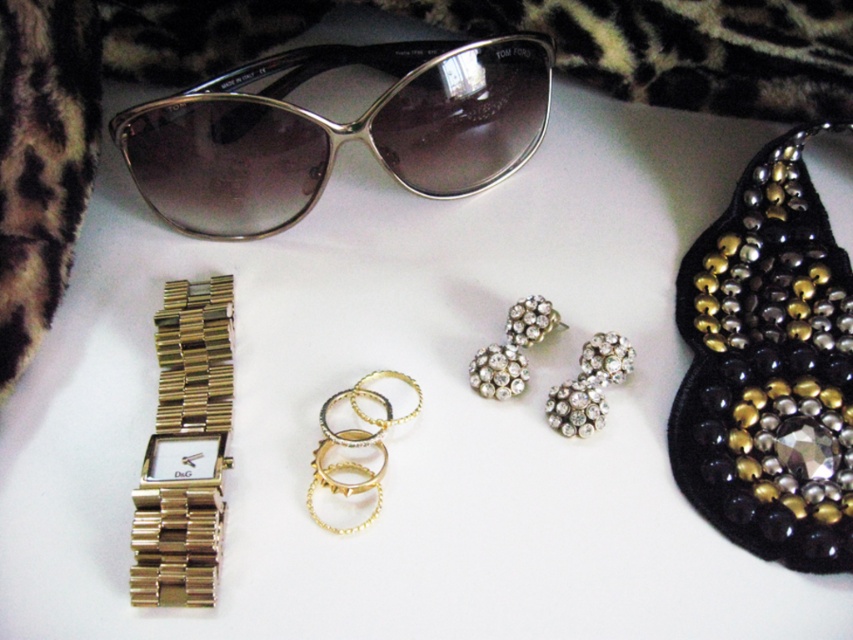
Does black sequined necklace at upper right come behind gold metallic rings at center?

No.

Does point (704, 364) come closer to viewer compared to point (376, 397)?

That is True.

This screenshot has height=640, width=853. What are the coordinates of `black sequined necklace at upper right` in the screenshot? It's located at (769, 368).

Between gold metallic watch at upper left and clear crystal earrings at center, which one is positioned higher?

clear crystal earrings at center is above.

Which is below, gold metallic watch at upper left or clear crystal earrings at center?

gold metallic watch at upper left

This screenshot has width=853, height=640. What are the coordinates of `gold metallic watch at upper left` in the screenshot? It's located at pyautogui.click(x=184, y=449).

How far apart are silver metallic sunglasses at upper center and clear crystal earrings at center?

silver metallic sunglasses at upper center and clear crystal earrings at center are 13.31 inches apart.

Who is more forward, (479, 189) or (526, 339)?

Point (526, 339) is more forward.

Locate an element on the screen. silver metallic sunglasses at upper center is located at coordinates (335, 129).